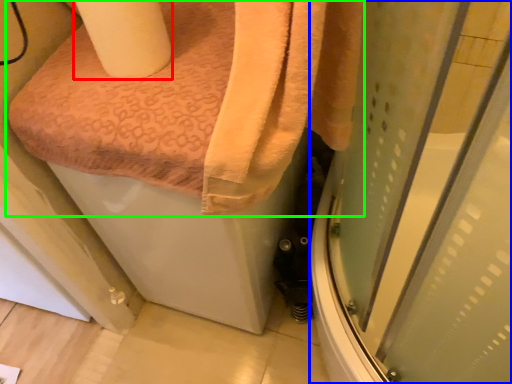
Question: Which object is the farthest from toilet paper (highlighted by a red box)? Choose among these: screen door (highlighted by a blue box) or towel (highlighted by a green box).

Choices:
 (A) screen door
 (B) towel

Answer: (A)